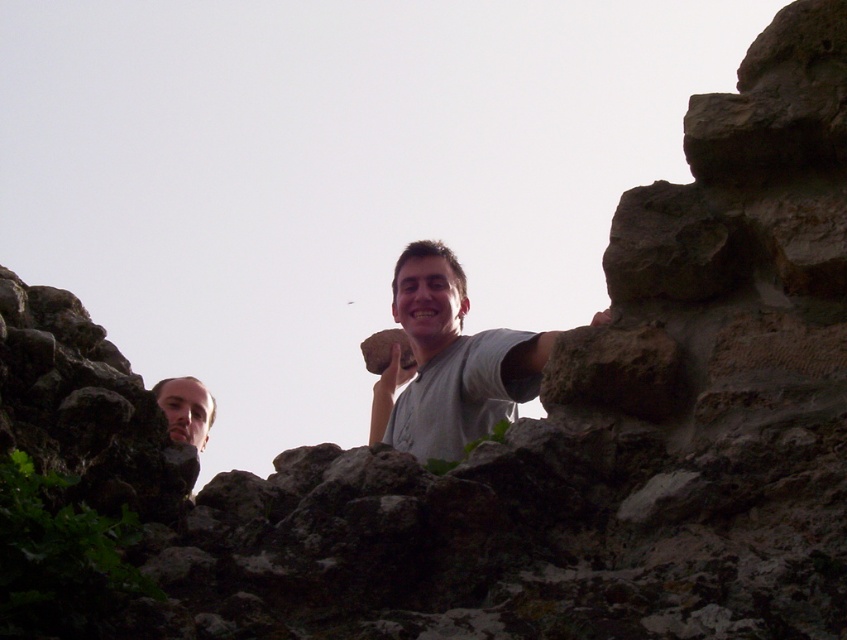
You are navigating a virtual reality game where you must move from one point to another on an ancient stone structure. You start at point (x=79, y=458) and need to reach point (x=449, y=326). The game requires you to determine if the starting point is closer to the edge of the structure than the destination. Can you determine this using the coordinates provided?

Point (x=79, y=458) is in front of point (x=449, y=326), so it is closer to the edge of the structure than the destination point.

You are taking a photo of the ancient stone structure with two people standing on it. The camera is positioned to capture both the person at point (17,442) and the person at point (380,349). Which person will appear larger in the photo?

The person at point (17,442) will appear larger in the photo because it is closer to the camera than point (380,349).